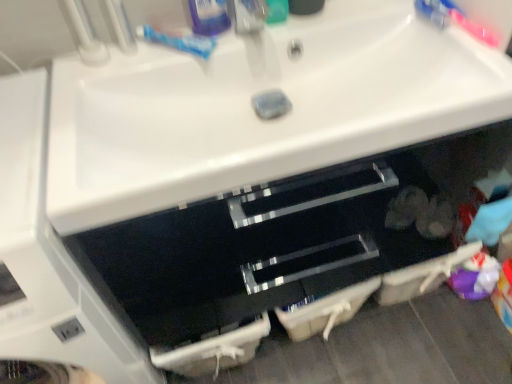
The height and width of the screenshot is (384, 512). I want to click on free region on the left part of blue glossy toothpaste tube at upper center, marked as the second toiletry in a right-to-left arrangement, so click(134, 60).